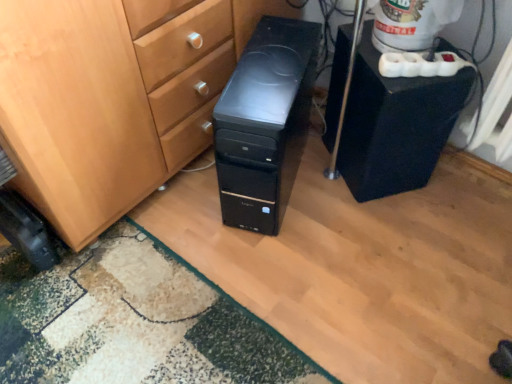
Locate an element on the screen. This screenshot has width=512, height=384. white plastic water cooler at upper right is located at coordinates (411, 23).

Describe the element at coordinates (265, 123) in the screenshot. I see `black plastic computer tower at center` at that location.

Where is `black plastic speaker at right`? This screenshot has width=512, height=384. black plastic speaker at right is located at coordinates (395, 125).

The height and width of the screenshot is (384, 512). Identify the location of green textured rug at lower left. (133, 322).

You are a GUI agent. You are given a task and a screenshot of the screen. Output one action in this format:
    pyautogui.click(x=<x>, y=<y>)
    Task: Click on the wheel behind the green textured rug at lower left
    The image size is (512, 384).
    Given the screenshot: What is the action you would take?
    pyautogui.click(x=26, y=231)

Between green textured rug at lower left and black rubber wheel at lower left, which one appears on the right side from the viewer's perspective?

green textured rug at lower left is more to the right.

Is point (71, 346) closer to viewer compared to point (33, 243)?

Yes, it is.

Who is taller, green textured rug at lower left or black rubber wheel at lower left?

With more height is black rubber wheel at lower left.

Can you confirm if green textured rug at lower left is thinner than black plastic computer tower at center?

Incorrect, the width of green textured rug at lower left is not less than that of black plastic computer tower at center.

From the image's perspective, who appears lower, green textured rug at lower left or black plastic computer tower at center?

green textured rug at lower left, from the image's perspective.

Based on their sizes in the image, would you say green textured rug at lower left is bigger or smaller than black plastic computer tower at center?

Considering their sizes, green textured rug at lower left takes up less space than black plastic computer tower at center.

Relative to black plastic computer tower at center, is green textured rug at lower left in front or behind?

Clearly, green textured rug at lower left is in front of black plastic computer tower at center.

Looking at this image, between white plastic water cooler at upper right and black plastic speaker at right, which one appears on the right side from the viewer's perspective?

Positioned to the right is white plastic water cooler at upper right.

From the image's perspective, would you say white plastic water cooler at upper right is shown under black plastic speaker at right?

No, from the image's perspective, white plastic water cooler at upper right is not beneath black plastic speaker at right.

Is white plastic water cooler at upper right facing towards black plastic speaker at right?

No, white plastic water cooler at upper right is not facing towards black plastic speaker at right.

Is white plastic water cooler at upper right not near black plastic speaker at right?

No, white plastic water cooler at upper right is not far away from black plastic speaker at right.

Is green textured rug at lower left oriented towards black plastic speaker at right?

No, green textured rug at lower left is not aimed at black plastic speaker at right.

Considering the relative sizes of green textured rug at lower left and black plastic speaker at right in the image provided, is green textured rug at lower left thinner than black plastic speaker at right?

No, green textured rug at lower left is not thinner than black plastic speaker at right.

In terms of size, does green textured rug at lower left appear bigger or smaller than black plastic speaker at right?

green textured rug at lower left is smaller than black plastic speaker at right.

Based on the photo, could you tell me if black plastic speaker at right is turned towards white plastic water cooler at upper right?

No, black plastic speaker at right is not aimed at white plastic water cooler at upper right.

Can you confirm if black plastic speaker at right is shorter than white plastic water cooler at upper right?

Incorrect, the height of black plastic speaker at right does not fall short of that of white plastic water cooler at upper right.

You are a GUI agent. You are given a task and a screenshot of the screen. Output one action in this format:
    pyautogui.click(x=<x>, y=<y>)
    Task: Click on the furniture on the left side of white plastic water cooler at upper right
    The image size is (512, 384).
    Given the screenshot: What is the action you would take?
    pyautogui.click(x=395, y=125)

Is white plastic water cooler at upper right located within black plastic speaker at right?

No, white plastic water cooler at upper right is not inside black plastic speaker at right.

Considering the relative sizes of black plastic computer tower at center and white plastic water cooler at upper right in the image provided, is black plastic computer tower at center smaller than white plastic water cooler at upper right?

No.

From the image's perspective, between black plastic computer tower at center and white plastic water cooler at upper right, which one is located above?

From the image's view, white plastic water cooler at upper right is above.

Could you measure the distance between black plastic computer tower at center and white plastic water cooler at upper right?

They are 14.47 inches apart.

Does point (287, 157) appear closer or farther from the camera than point (426, 27)?

Point (287, 157).

Considering the positions of objects black plastic speaker at right and black plastic computer tower at center in the image provided, who is behind, black plastic speaker at right or black plastic computer tower at center?

black plastic speaker at right is further away from the camera.

Is black plastic speaker at right bigger than black plastic computer tower at center?

No, black plastic speaker at right is not bigger than black plastic computer tower at center.

Is black plastic speaker at right looking in the opposite direction of black plastic computer tower at center?

No, black plastic speaker at right is not facing away from black plastic computer tower at center.

Locate an element on the screen. The width and height of the screenshot is (512, 384). wheel located above the green textured rug at lower left (from the image's perspective) is located at coordinates (26, 231).

Locate an element on the screen. The height and width of the screenshot is (384, 512). computer tower located behind the green textured rug at lower left is located at coordinates (265, 123).

Based on their spatial positions, is black plastic speaker at right or black plastic computer tower at center closer to green textured rug at lower left?

black plastic computer tower at center is closer to green textured rug at lower left.

When comparing their distances from black plastic computer tower at center, does white plastic water cooler at upper right or black plastic speaker at right seem further?

The object further to black plastic computer tower at center is white plastic water cooler at upper right.

When comparing their distances from black rubber wheel at lower left, does black plastic speaker at right or green textured rug at lower left seem closer?

Among the two, green textured rug at lower left is located nearer to black rubber wheel at lower left.

Based on their spatial positions, is white plastic water cooler at upper right or black rubber wheel at lower left closer to green textured rug at lower left?

Based on the image, black rubber wheel at lower left appears to be nearer to green textured rug at lower left.

Looking at the image, which one is located further to green textured rug at lower left, black rubber wheel at lower left or white plastic water cooler at upper right?

white plastic water cooler at upper right is further to green textured rug at lower left.

Estimate the real-world distances between objects in this image. Which object is closer to black plastic speaker at right, white plastic water cooler at upper right or black plastic computer tower at center?

Based on the image, white plastic water cooler at upper right appears to be nearer to black plastic speaker at right.

Considering their positions, is white plastic water cooler at upper right positioned closer to black plastic speaker at right than green textured rug at lower left?

Among the two, white plastic water cooler at upper right is located nearer to black plastic speaker at right.

Looking at the image, which one is located further to black plastic computer tower at center, green textured rug at lower left or white plastic water cooler at upper right?

Among the two, green textured rug at lower left is located further to black plastic computer tower at center.

What are the coordinates of `doormat situated between black rubber wheel at lower left and black plastic speaker at right from left to right` in the screenshot? It's located at (133, 322).

The image size is (512, 384). In order to click on doormat between black rubber wheel at lower left and white plastic water cooler at upper right in the horizontal direction in this screenshot , I will do `click(133, 322)`.

Identify the location of furniture between black rubber wheel at lower left and white plastic water cooler at upper right from left to right. The image size is (512, 384). (395, 125).

Locate an element on the screen. doormat situated between black rubber wheel at lower left and black plastic computer tower at center from left to right is located at coordinates (133, 322).